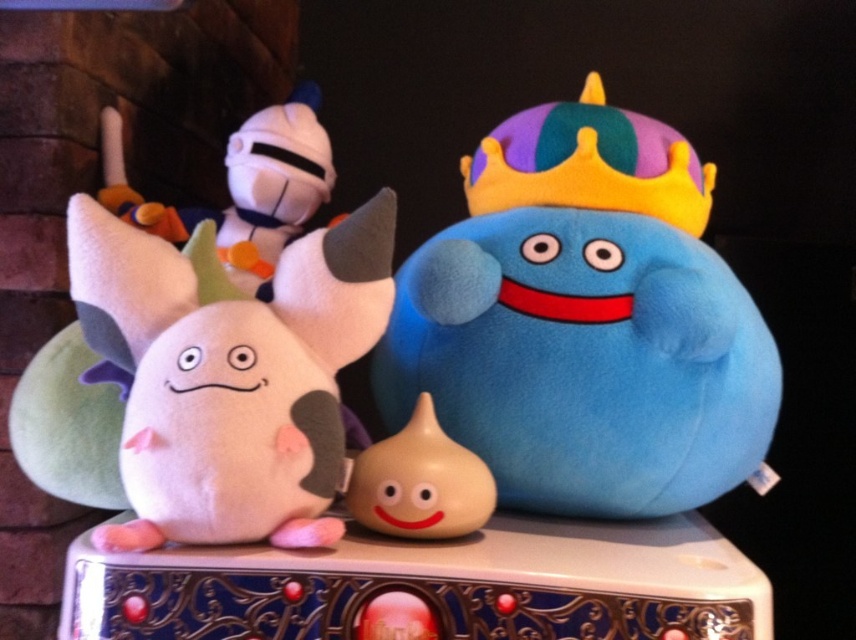
Question: Among these objects, which one is farthest from the camera?

Choices:
 (A) blue plush toy at center
 (B) smooth beige gourd at center
 (C) soft pink plushie at left

Answer: (A)

Question: Is soft pink plushie at left further to camera compared to smooth beige gourd at center?

Choices:
 (A) no
 (B) yes

Answer: (A)

Question: Which of the following is the closest to the observer?

Choices:
 (A) (373, 365)
 (B) (409, 528)
 (C) (96, 260)

Answer: (C)

Question: Can you confirm if blue plush toy at center is positioned above smooth beige gourd at center?

Choices:
 (A) no
 (B) yes

Answer: (B)

Question: Which of these objects is positioned closest to the smooth beige gourd at center?

Choices:
 (A) blue plush toy at center
 (B) soft pink plushie at left

Answer: (B)

Question: Does blue plush toy at center appear over smooth beige gourd at center?

Choices:
 (A) no
 (B) yes

Answer: (B)